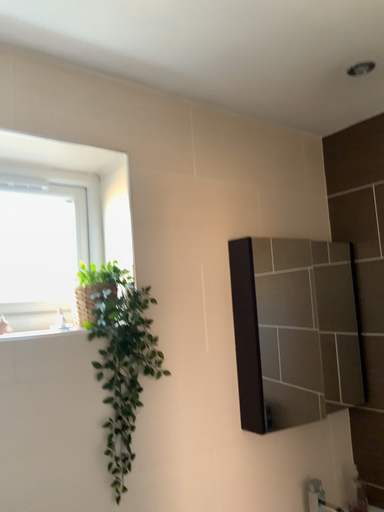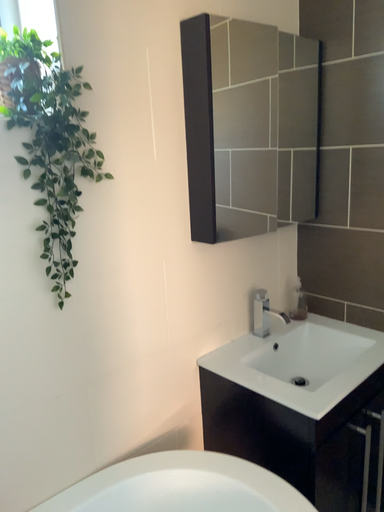
Question: Which way did the camera rotate in the video?

Choices:
 (A) rotated downward
 (B) rotated upward

Answer: (A)